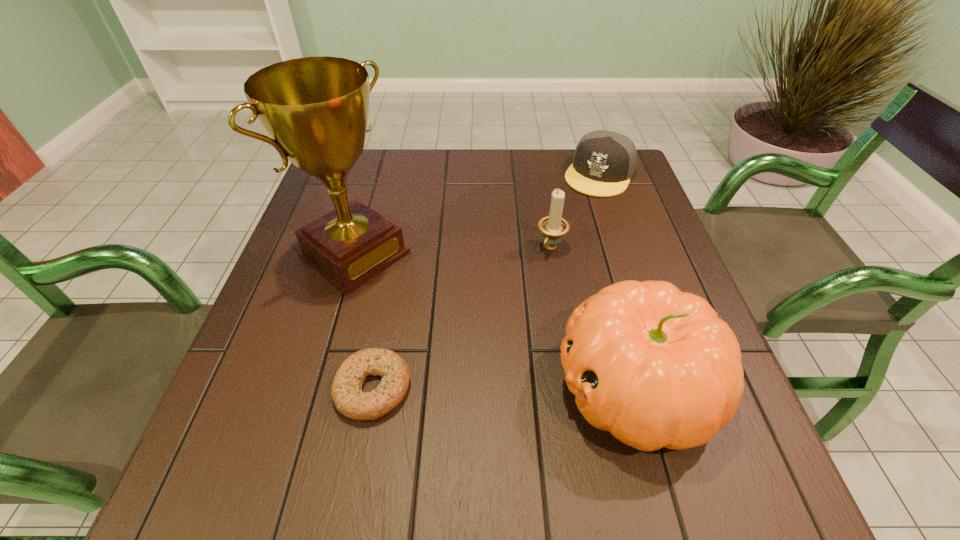
Locate an element on the screen. the shortest object is located at coordinates (349, 400).

Where is `pumpkin`? The height and width of the screenshot is (540, 960). pumpkin is located at coordinates (656, 367).

What are the coordinates of `the third shortest object` in the screenshot? It's located at (553, 227).

Locate an element on the screen. the second shortest object is located at coordinates (604, 161).

Identify the location of cap. (604, 161).

What are the coordinates of `award` in the screenshot? It's located at (316, 109).

You are a GUI agent. You are given a task and a screenshot of the screen. Output one action in this format:
    pyautogui.click(x=<x>, y=<y>)
    Task: Click on the free space located 0.130m on the left of the bagel
    
    Given the screenshot: What is the action you would take?
    pyautogui.click(x=263, y=388)

This screenshot has width=960, height=540. Find the location of `free space located on the carved face of the pumpkin`. free space located on the carved face of the pumpkin is located at coordinates (395, 386).

Where is `free location located on the carved face of the pumpkin`? The height and width of the screenshot is (540, 960). free location located on the carved face of the pumpkin is located at coordinates (455, 386).

Where is `vacant region located 0.050m on the carved face of the pumpkin`? This screenshot has height=540, width=960. vacant region located 0.050m on the carved face of the pumpkin is located at coordinates (527, 386).